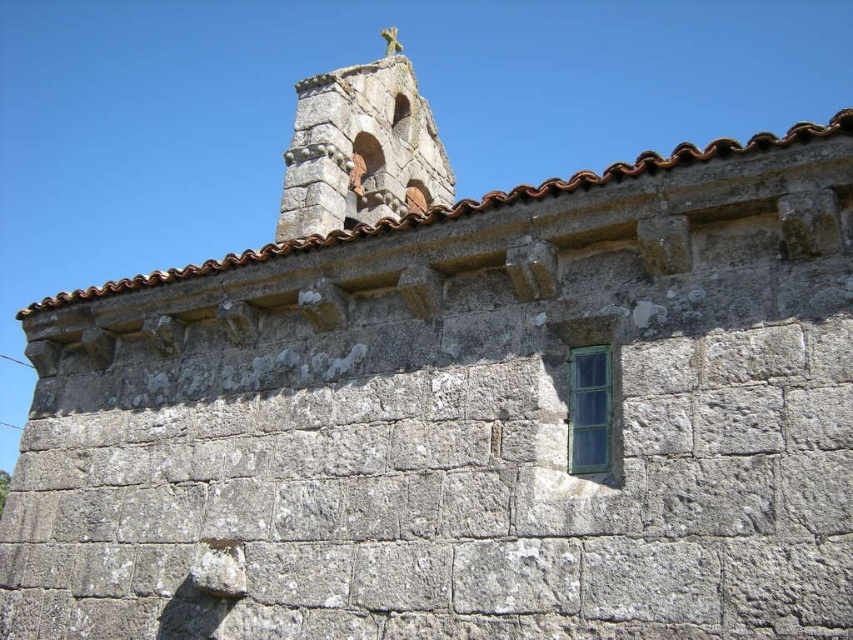
Does stone cross at upper center appear on the right side of green glass window at upper right?

In fact, stone cross at upper center is to the left of green glass window at upper right.

Between point (315, 100) and point (581, 364), which one is positioned in front?

Point (581, 364)

Who is more forward, (x=369, y=179) or (x=579, y=360)?

Positioned in front is point (x=579, y=360).

Locate an element on the screen. This screenshot has height=640, width=853. stone cross at upper center is located at coordinates (361, 148).